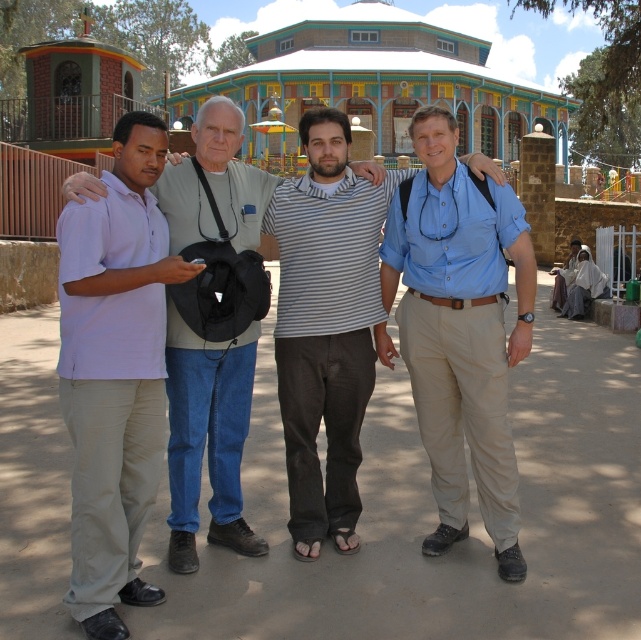
Which of these two, blue cotton shirt at center or matte gray shirt at center, stands taller?

Standing taller between the two is blue cotton shirt at center.

Does blue cotton shirt at center have a lesser width compared to matte gray shirt at center?

In fact, blue cotton shirt at center might be wider than matte gray shirt at center.

At what (x,y) coordinates should I click in order to perform the action: click on blue cotton shirt at center. Please return your answer as a coordinate pair (x, y). Looking at the image, I should click on (460, 332).

The width and height of the screenshot is (641, 640). I want to click on blue cotton shirt at center, so click(x=460, y=332).

Can you confirm if striped cotton shirt at center is positioned below matte gray shirt at center?

Actually, striped cotton shirt at center is above matte gray shirt at center.

Find the location of a particular element. The width and height of the screenshot is (641, 640). striped cotton shirt at center is located at coordinates (326, 324).

In the scene shown: Measure the distance between point (308, 548) and camera.

The distance of point (308, 548) from camera is 14.35 feet.

In order to click on striped cotton shirt at center in this screenshot , I will do `click(326, 324)`.

Does blue cotton shirt at center have a greater height compared to striped cotton shirt at center?

Yes.

Can you confirm if blue cotton shirt at center is positioned to the right of striped cotton shirt at center?

Yes, blue cotton shirt at center is to the right of striped cotton shirt at center.

Where is `blue cotton shirt at center`? This screenshot has width=641, height=640. blue cotton shirt at center is located at coordinates (460, 332).